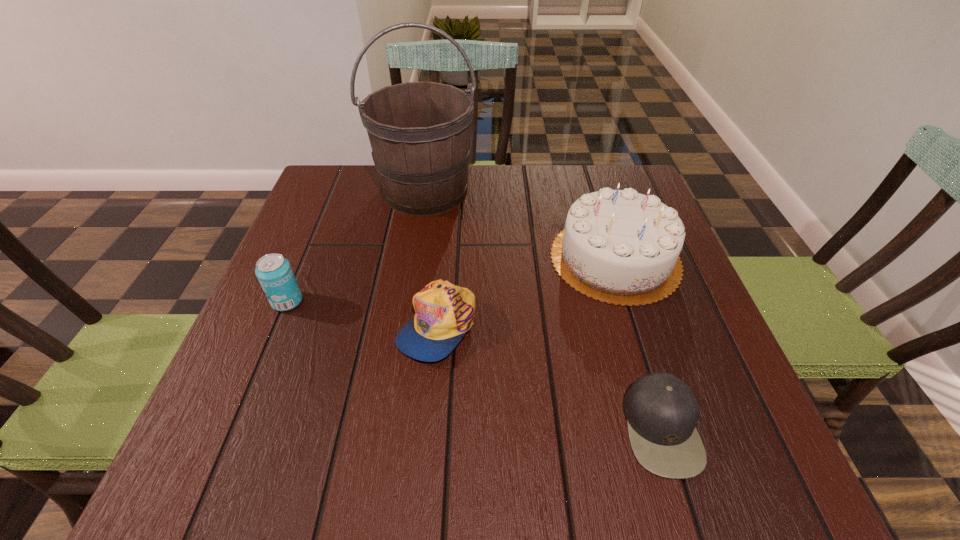
At what (x,y) coordinates should I click in order to perform the action: click on bucket. Please return your answer as a coordinate pair (x, y). Image resolution: width=960 pixels, height=540 pixels. Looking at the image, I should click on (419, 132).

In order to click on birthday cake in this screenshot , I will do `click(618, 246)`.

Locate an element on the screen. This screenshot has height=540, width=960. beer can is located at coordinates (274, 272).

You are a GUI agent. You are given a task and a screenshot of the screen. Output one action in this format:
    pyautogui.click(x=<x>, y=<y>)
    Task: Click on the leftmost object
    The width and height of the screenshot is (960, 540).
    Given the screenshot: What is the action you would take?
    pyautogui.click(x=274, y=272)

Identify the location of the left cap. (444, 312).

The width and height of the screenshot is (960, 540). Find the location of `the nearer cap`. the nearer cap is located at coordinates (662, 411).

Where is `the right cap`? The height and width of the screenshot is (540, 960). the right cap is located at coordinates (662, 411).

Where is `vacant space situated 0.250m on the right of the tallest object`? vacant space situated 0.250m on the right of the tallest object is located at coordinates (570, 190).

At what (x,y) coordinates should I click in order to perform the action: click on vacant space located 0.050m on the left of the birthday cake. Please return your answer as a coordinate pair (x, y). This screenshot has width=960, height=540. Looking at the image, I should click on (528, 258).

Locate an element on the screen. The image size is (960, 540). vacant space located on the right of the leftmost object is located at coordinates (400, 301).